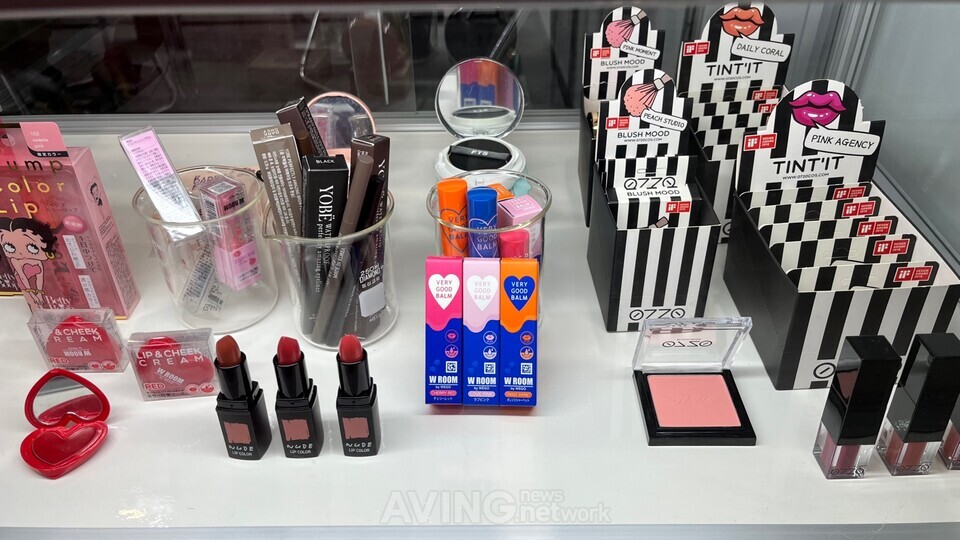
The height and width of the screenshot is (540, 960). What are the coordinates of `makeup brush` in the screenshot? It's located at [x=640, y=94], [x=613, y=30].